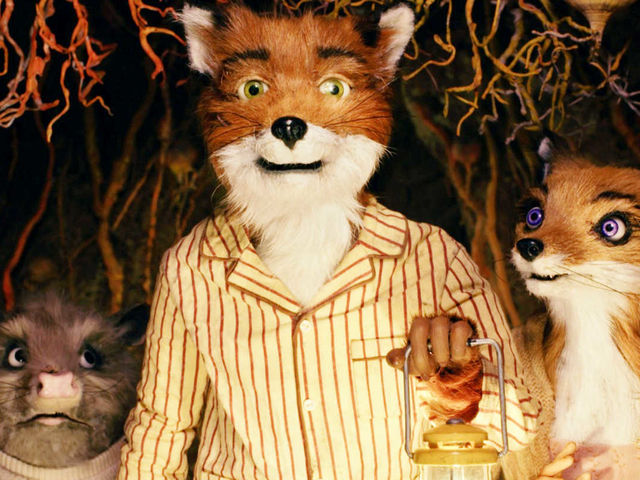
Where is `lantern`? The height and width of the screenshot is (480, 640). lantern is located at coordinates (452, 449).